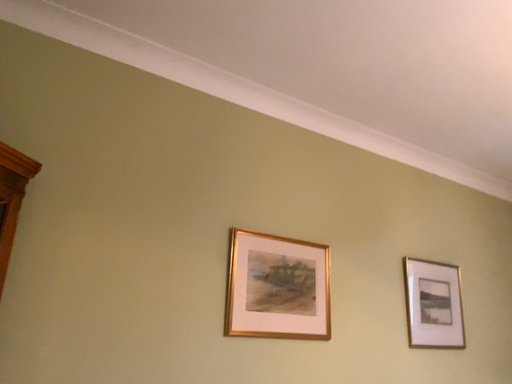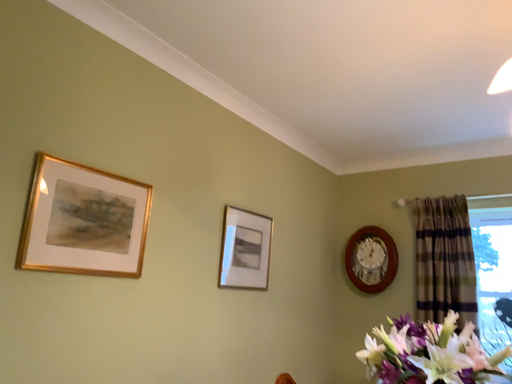
Question: Which way did the camera rotate in the video?

Choices:
 (A) rotated right
 (B) rotated left

Answer: (A)